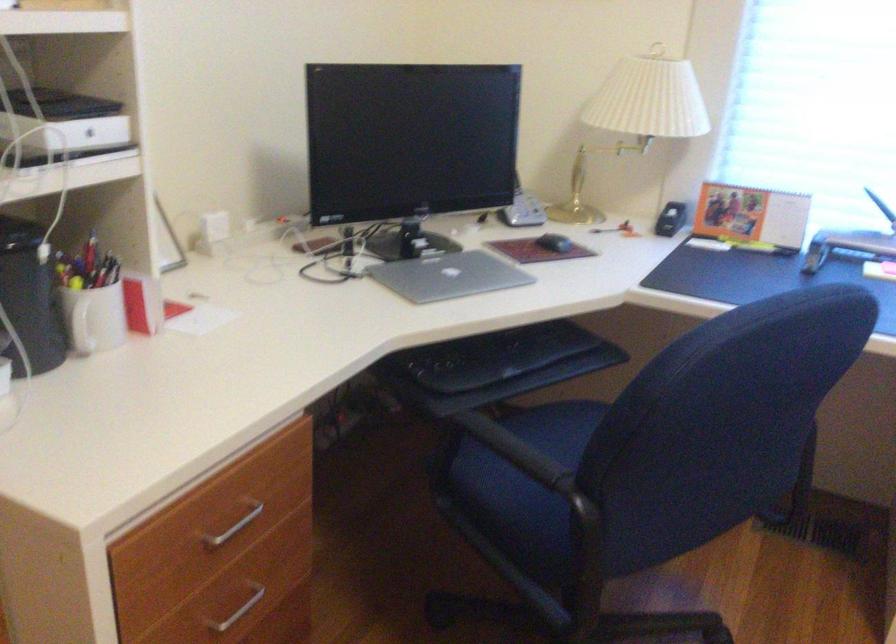
Where would you sit the blue chair sitting surface? Please return your answer as a coordinate pair (x, y).

(524, 462)